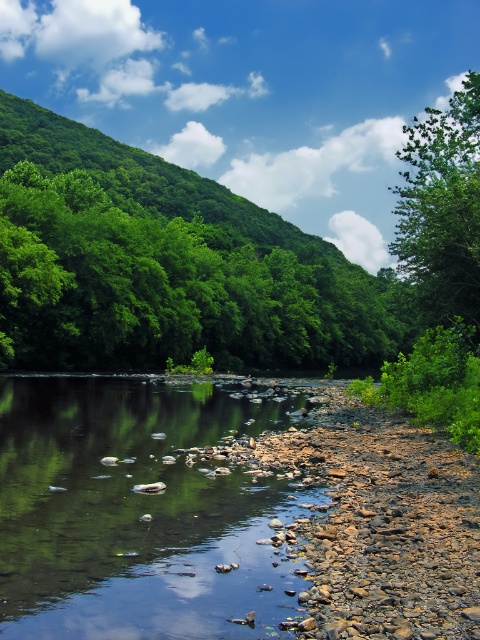
What is the exact location of the smooth rock river at center in the image?

The smooth rock river at center is located at point (x=140, y=513).

You are standing at the riverbank and want to walk towards the two points marked in the image. Which point would you reach first, point (40, 324) or point (107, 536)?

You would reach point (40, 324) first because it is closer to you than point (107, 536), which is further away.